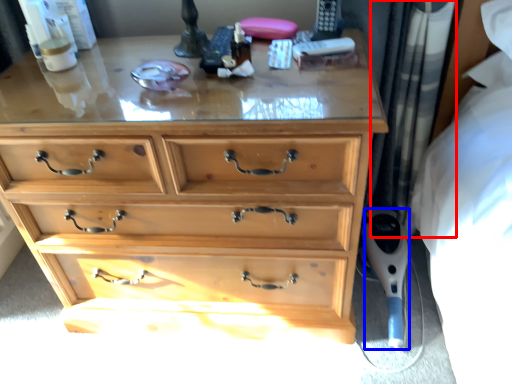
Question: Which point is closer to the camera, curtain (highlighted by a red box) or equipment (highlighted by a blue box)?

Choices:
 (A) curtain
 (B) equipment

Answer: (A)